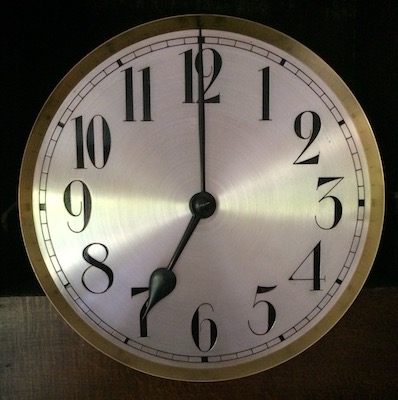
At what (x,y) coordinates should I click in order to perform the action: click on ivory colored face of clock. Please return your answer as a coordinate pair (x, y). The image size is (398, 400). Looking at the image, I should click on (234, 254), (154, 178).